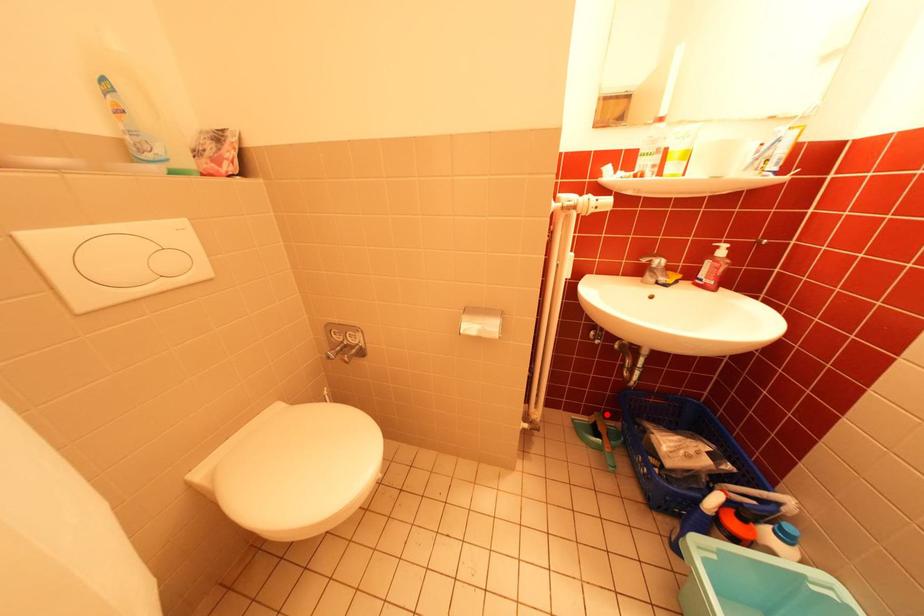
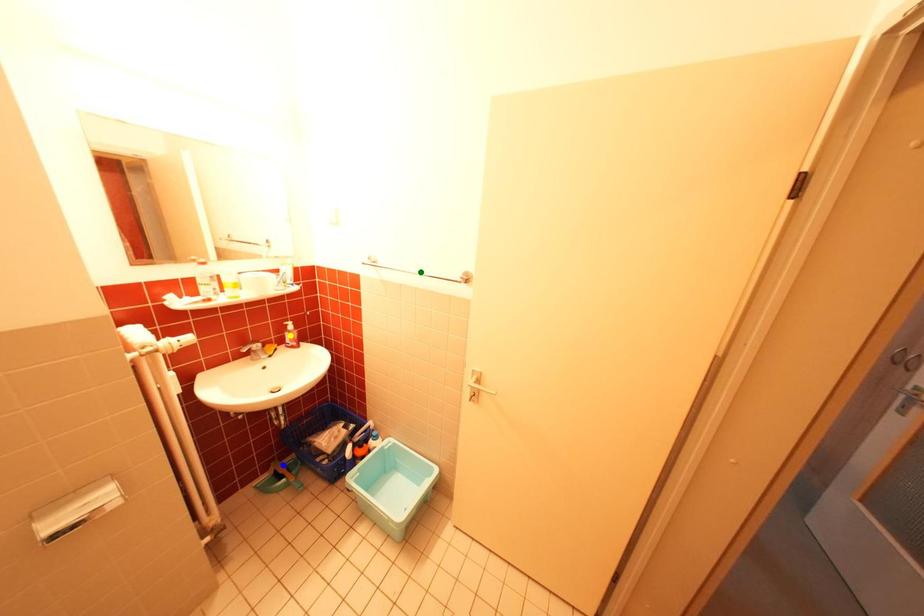
Question: I am providing you with two images of the same scene from different viewpoints. A red point is marked on the first image. You are given multiple points on the second image. Which point in image 2 is actually the same real-world point as the red point in image 1?

Choices:
 (A) yellow point
 (B) blue point
 (C) green point

Answer: (B)